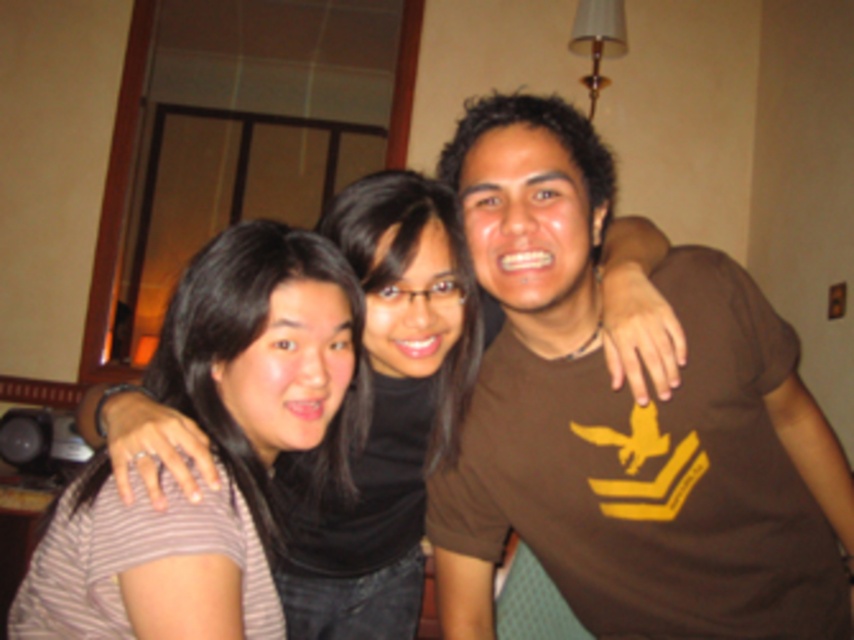
Does brown matte t-shirt at center have a smaller size compared to matte striped shirt at left?

Indeed, brown matte t-shirt at center has a smaller size compared to matte striped shirt at left.

Is point (518, 266) positioned in front of point (357, 556)?

Yes.

This screenshot has height=640, width=854. Describe the element at coordinates (629, 420) in the screenshot. I see `brown matte t-shirt at center` at that location.

At what (x,y) coordinates should I click in order to perform the action: click on brown matte t-shirt at center. Please return your answer as a coordinate pair (x, y). Looking at the image, I should click on 629,420.

Does striped fabric shirt at left have a lesser width compared to matte striped shirt at left?

Yes.

Locate an element on the screen. striped fabric shirt at left is located at coordinates 214,448.

Does point (189, 608) lie behind point (129, 406)?

No, it is not.

In order to click on striped fabric shirt at left in this screenshot , I will do `click(214, 448)`.

Who is shorter, brown matte t-shirt at center or striped fabric shirt at left?

striped fabric shirt at left

Does point (531, 429) come farther from viewer compared to point (79, 564)?

Yes, it is.

Does point (782, 598) come behind point (156, 515)?

Yes.

What are the coordinates of `brown matte t-shirt at center` in the screenshot? It's located at (629, 420).